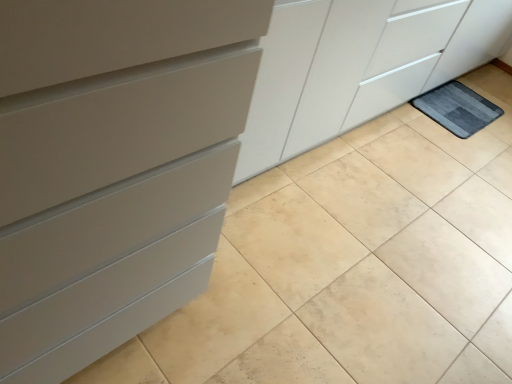
This screenshot has width=512, height=384. What do you see at coordinates (113, 166) in the screenshot?
I see `matte gray chest of drawers at left` at bounding box center [113, 166].

At what (x,y) coordinates should I click in order to perform the action: click on matte gray chest of drawers at left. Please return your answer as a coordinate pair (x, y). Looking at the image, I should click on (113, 166).

Where is `gray textured bath mat at lower right`? The image size is (512, 384). gray textured bath mat at lower right is located at coordinates 457,108.

The height and width of the screenshot is (384, 512). Describe the element at coordinates (457, 108) in the screenshot. I see `gray textured bath mat at lower right` at that location.

At what (x,y) coordinates should I click in order to perform the action: click on matte gray chest of drawers at left. Please return your answer as a coordinate pair (x, y). The height and width of the screenshot is (384, 512). Looking at the image, I should click on (113, 166).

Based on the photo, based on their positions, is gray textured bath mat at lower right located to the left or right of matte gray chest of drawers at left?

gray textured bath mat at lower right is positioned on matte gray chest of drawers at left's right side.

Considering their positions, is gray textured bath mat at lower right located in front of or behind matte gray chest of drawers at left?

In the image, gray textured bath mat at lower right appears behind matte gray chest of drawers at left.

Between point (475, 107) and point (123, 32), which one is positioned behind?

Point (475, 107)

In the scene shown: From the image's perspective, who appears lower, gray textured bath mat at lower right or matte gray chest of drawers at left?

matte gray chest of drawers at left, from the image's perspective.

From a real-world perspective, between gray textured bath mat at lower right and matte gray chest of drawers at left, who is vertically lower?

gray textured bath mat at lower right.

Considering the sizes of objects gray textured bath mat at lower right and matte gray chest of drawers at left in the image provided, who is thinner, gray textured bath mat at lower right or matte gray chest of drawers at left?

gray textured bath mat at lower right.

Between gray textured bath mat at lower right and matte gray chest of drawers at left, which one has more height?

Standing taller between the two is matte gray chest of drawers at left.

Considering the relative sizes of gray textured bath mat at lower right and matte gray chest of drawers at left in the image provided, is gray textured bath mat at lower right bigger than matte gray chest of drawers at left?

No.

Is gray textured bath mat at lower right positioned beyond the bounds of matte gray chest of drawers at left?

Yes, gray textured bath mat at lower right is outside of matte gray chest of drawers at left.

Is gray textured bath mat at lower right with matte gray chest of drawers at left?

No, gray textured bath mat at lower right is not with matte gray chest of drawers at left.

Could you tell me if gray textured bath mat at lower right is facing matte gray chest of drawers at left?

No, gray textured bath mat at lower right does not turn towards matte gray chest of drawers at left.

What's the angular difference between gray textured bath mat at lower right and matte gray chest of drawers at left's facing directions?

The facing directions of gray textured bath mat at lower right and matte gray chest of drawers at left are 0.36 degrees apart.

You are a GUI agent. You are given a task and a screenshot of the screen. Output one action in this format:
    pyautogui.click(x=<x>, y=<y>)
    Task: Click on the chest of drawers lying on the left of gray textured bath mat at lower right
    This screenshot has height=384, width=512.
    Given the screenshot: What is the action you would take?
    pyautogui.click(x=113, y=166)

Which is more to the left, matte gray chest of drawers at left or gray textured bath mat at lower right?

matte gray chest of drawers at left is more to the left.

Which object is further away from the camera, matte gray chest of drawers at left or gray textured bath mat at lower right?

gray textured bath mat at lower right.

Is point (175, 129) in front of point (428, 114)?

Yes, it is in front of point (428, 114).

From the image's perspective, which is below, matte gray chest of drawers at left or gray textured bath mat at lower right?

matte gray chest of drawers at left, from the image's perspective.

From a real-world perspective, is matte gray chest of drawers at left positioned under gray textured bath mat at lower right based on gravity?

No, from a real-world perspective, matte gray chest of drawers at left is not below gray textured bath mat at lower right.

In the scene shown: Considering the sizes of matte gray chest of drawers at left and gray textured bath mat at lower right in the image, is matte gray chest of drawers at left wider or thinner than gray textured bath mat at lower right?

Clearly, matte gray chest of drawers at left has more width compared to gray textured bath mat at lower right.

Between matte gray chest of drawers at left and gray textured bath mat at lower right, which one has less height?

gray textured bath mat at lower right.

Which of these two, matte gray chest of drawers at left or gray textured bath mat at lower right, is bigger?

matte gray chest of drawers at left.

Can we say matte gray chest of drawers at left lies outside gray textured bath mat at lower right?

Absolutely, matte gray chest of drawers at left is external to gray textured bath mat at lower right.

Is matte gray chest of drawers at left directly adjacent to gray textured bath mat at lower right?

No, matte gray chest of drawers at left is not making contact with gray textured bath mat at lower right.

Is matte gray chest of drawers at left positioned with its back to gray textured bath mat at lower right?

matte gray chest of drawers at left does not have its back to gray textured bath mat at lower right.

Can you tell me how much matte gray chest of drawers at left and gray textured bath mat at lower right differ in facing direction?

0.36 degrees.

Measure the distance between matte gray chest of drawers at left and gray textured bath mat at lower right.

The distance of matte gray chest of drawers at left from gray textured bath mat at lower right is 2.14 meters.

The width and height of the screenshot is (512, 384). I want to click on bath mat located above the matte gray chest of drawers at left (from the image's perspective), so click(457, 108).

This screenshot has height=384, width=512. I want to click on bath mat behind the matte gray chest of drawers at left, so click(457, 108).

The height and width of the screenshot is (384, 512). Find the location of `chest of drawers in front of the gray textured bath mat at lower right`. chest of drawers in front of the gray textured bath mat at lower right is located at coordinates (113, 166).